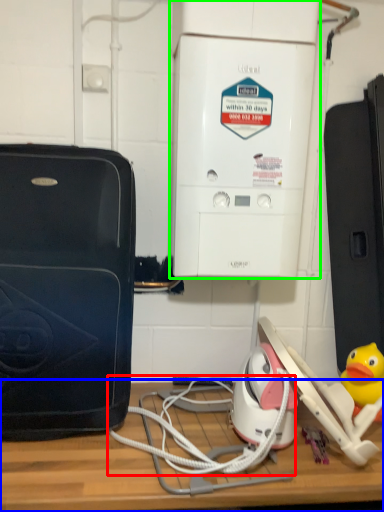
Question: Estimate the real-world distances between objects in this image. Which object is farther from cable (highlighted by a red box), table (highlighted by a blue box) or home appliance (highlighted by a green box)?

Choices:
 (A) table
 (B) home appliance

Answer: (B)